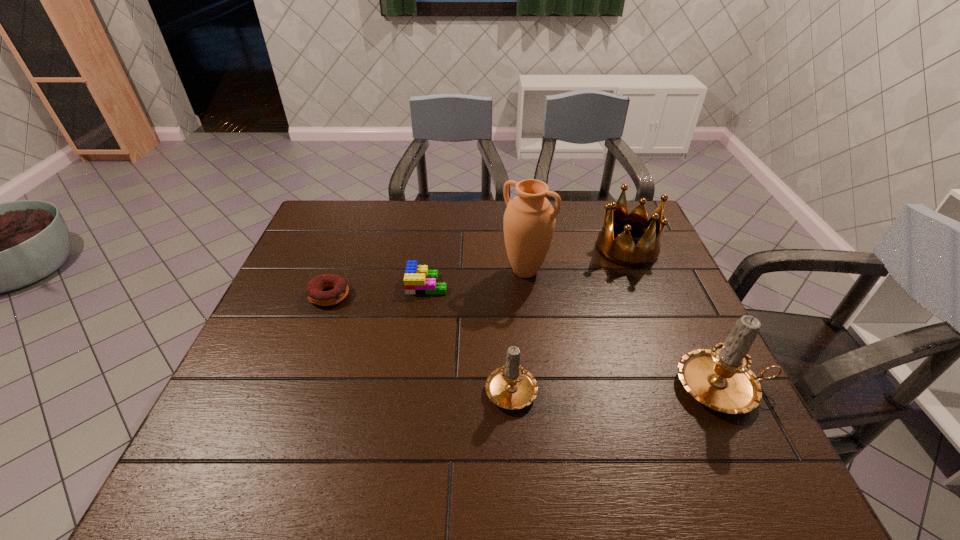
Identify the location of free point that keeps the candles evenly spaced on the left. The height and width of the screenshot is (540, 960). (299, 386).